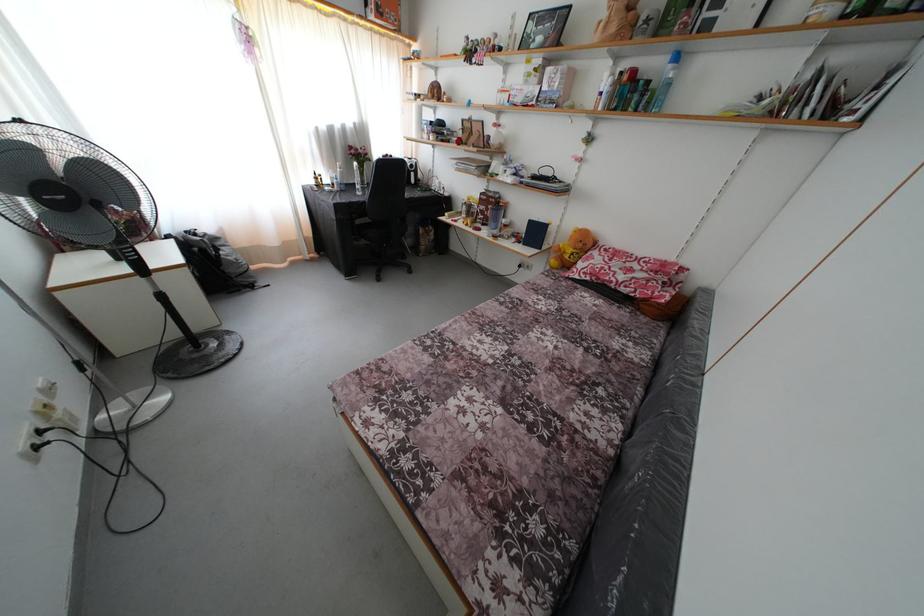
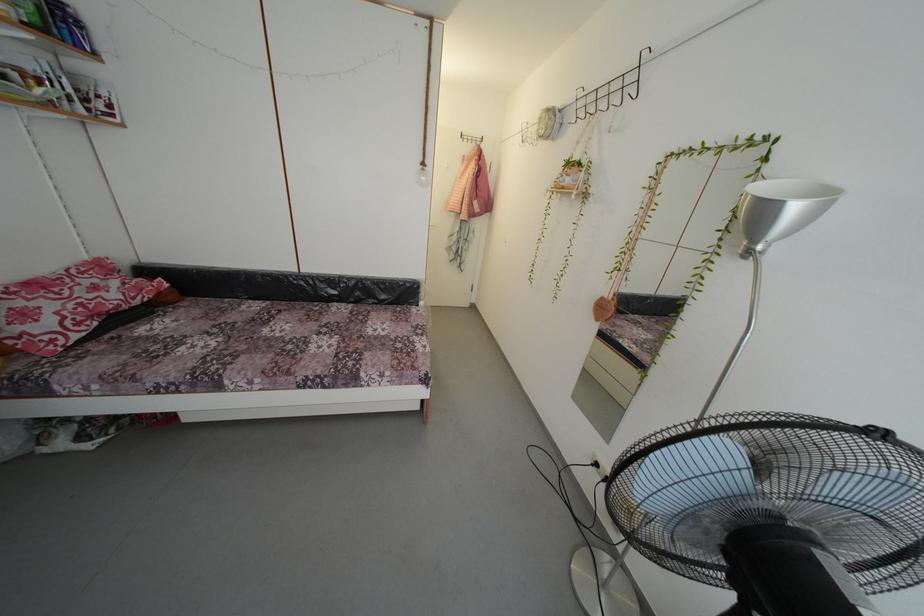
Find the pixel in the second image that matches point 604,261 in the first image.

(34, 306)